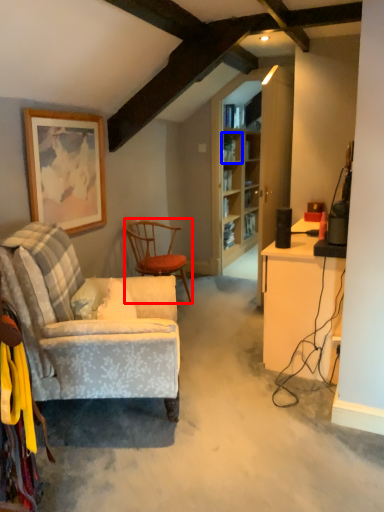
Question: Which object is closer to the camera taking this photo, chair (highlighted by a red box) or shelf (highlighted by a blue box)?

Choices:
 (A) chair
 (B) shelf

Answer: (A)